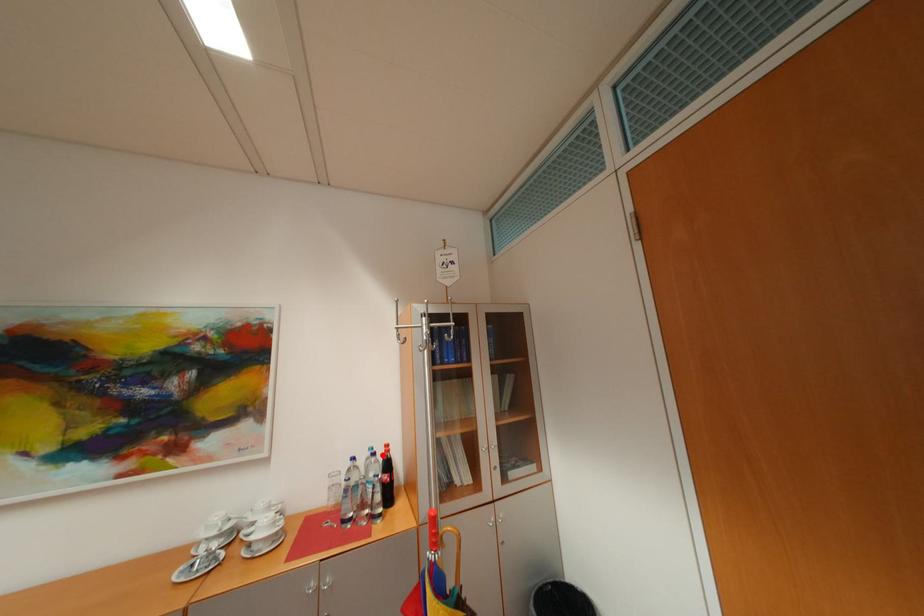
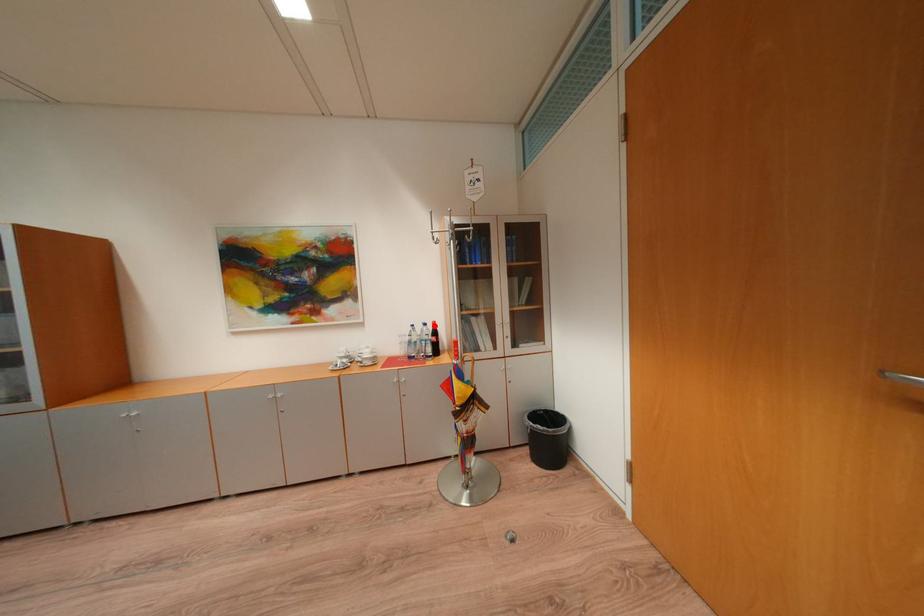
I am providing you with two images of the same scene from different viewpoints. A red point is marked on the first image and another point is marked on the second image. Is the marked point in image1 the same physical position as the marked point in image2?

Yes